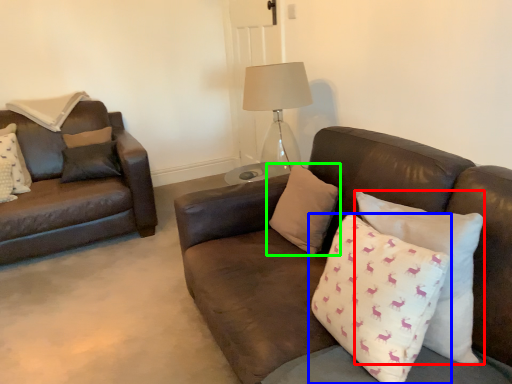
Question: Which object is the closest to the pillow (highlighted by a red box)? Choose among these: pillow (highlighted by a blue box) or pillow (highlighted by a green box).

Choices:
 (A) pillow
 (B) pillow

Answer: (A)